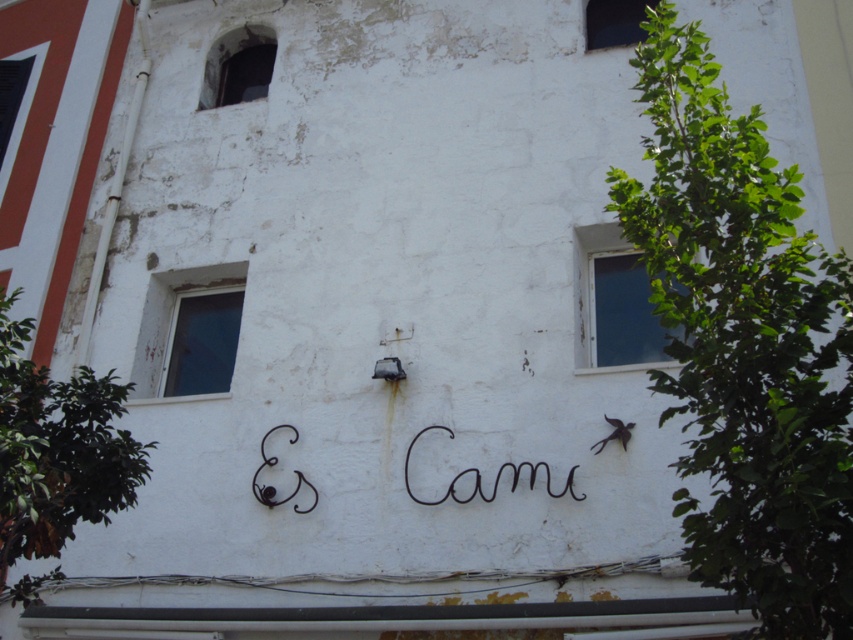
Question: Can you confirm if white painted wood window at upper left is positioned to the right of transparent glass window at upper center?

Choices:
 (A) no
 (B) yes

Answer: (A)

Question: Among these objects, which one is farthest from the camera?

Choices:
 (A) black wire writing at center
 (B) dark glass window at upper left
 (C) transparent glass window at upper center

Answer: (B)

Question: Can you confirm if white painted wood window at upper left is positioned above dark glass window at upper left?

Choices:
 (A) yes
 (B) no

Answer: (B)

Question: Estimate the real-world distances between objects in this image. Which object is closer to the transparent glass window at upper center?

Choices:
 (A) black wire writing at center
 (B) white painted wood window at upper right
 (C) dark glass window at upper left

Answer: (B)

Question: Which of the following is the closest to the observer?

Choices:
 (A) (589, 275)
 (B) (514, 484)
 (C) (247, 99)
 (D) (144, 310)

Answer: (B)

Question: Is white painted wood window at upper left positioned in front of transparent glass window at upper center?

Choices:
 (A) yes
 (B) no

Answer: (A)